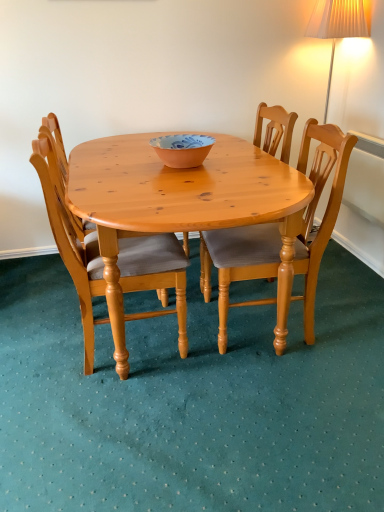
Question: Would you say pine wood chair at center, the 1th chair when ordered from left to right, is to the left or to the right of wooden chair at center, the second chair from the right, in the picture?

Choices:
 (A) right
 (B) left

Answer: (B)

Question: From the image's perspective, is pine wood chair at center, which is the third chair from right to left, above or below wooden chair at center, which is the second chair in left-to-right order?

Choices:
 (A) above
 (B) below

Answer: (B)

Question: Which of these objects is positioned closest to the light brown wooden chair at center, arranged as the 1th chair when viewed from the right?

Choices:
 (A) pine wood chair at center, which is the third chair from right to left
 (B) wooden chair at center, which is the second chair in left-to-right order
 (C) matte orange bowl at center

Answer: (B)

Question: Considering the real-world distances, which object is farthest from the matte orange bowl at center?

Choices:
 (A) light brown wooden chair at center, positioned as the 3th chair in left-to-right order
 (B) wooden chair at center, the second chair from the right
 (C) pine wood chair at center, which is the third chair from right to left

Answer: (A)